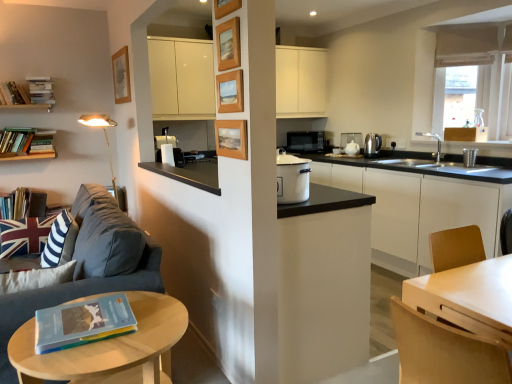
The image size is (512, 384). What do you see at coordinates (352, 148) in the screenshot? I see `white ceramic teapot at center, placed as the 4th appliance when sorted from right to left` at bounding box center [352, 148].

What is the approximate width of hardcover book at left, the 6th book positioned from the right?

hardcover book at left, the 6th book positioned from the right, is 7.42 inches wide.

Find the location of a particular element. white matte cabinet at center is located at coordinates (419, 204).

Image resolution: width=512 pixels, height=384 pixels. What do you see at coordinates (419, 204) in the screenshot? I see `white matte cabinet at center` at bounding box center [419, 204].

Where is `white ceramic teapot at center, positioned as the third appliance in back-to-front order`? Image resolution: width=512 pixels, height=384 pixels. white ceramic teapot at center, positioned as the third appliance in back-to-front order is located at coordinates (352, 148).

What's the angular difference between light wood/woodenobject at lower left and light brown wood chair at lower right's facing directions?

They differ by 89.2 degrees in their facing directions.

Which is nearer, (56, 356) or (452, 351)?

The point (452, 351) is closer.

Considering the positions of objects light wood/woodenobject at lower left and light brown wood chair at lower right in the image provided, who is more to the right, light wood/woodenobject at lower left or light brown wood chair at lower right?

From the viewer's perspective, light brown wood chair at lower right appears more on the right side.

Is light wood/woodenobject at lower left facing away from light brown wood chair at lower right?

Yes, light wood/woodenobject at lower left is positioned with its back facing light brown wood chair at lower right.

Is light wood/woodenobject at lower left to the right of black matte counter top at center from the viewer's perspective?

No.

Between point (34, 336) and point (210, 187), which one is positioned in front?

Positioned in front is point (34, 336).

From a real-world perspective, which is physically below, light wood/woodenobject at lower left or black matte counter top at center?

light wood/woodenobject at lower left, from a real-world perspective.

Is light wood/woodenobject at lower left oriented towards black matte counter top at center?

No, light wood/woodenobject at lower left is not oriented towards black matte counter top at center.

How many degrees apart are the facing directions of beige fabric curtain at upper right and hardcover books at upper left, the 5th book positioned from the front?

46.3 degrees separate the facing orientations of beige fabric curtain at upper right and hardcover books at upper left, the 5th book positioned from the front.

Between beige fabric curtain at upper right and hardcover books at upper left, which is counted as the third book, starting from the right, which one has larger size?

beige fabric curtain at upper right is bigger.

From the image's perspective, is beige fabric curtain at upper right located above hardcover books at upper left, the 4th book from the left?

Yes, from the image's perspective, beige fabric curtain at upper right is on top of hardcover books at upper left, the 4th book from the left.

Is beige fabric curtain at upper right facing away from hardcover books at upper left, which is counted as the third book, starting from the right?

No, hardcover books at upper left, which is counted as the third book, starting from the right, is not at the back of beige fabric curtain at upper right.

From their relative heights in the image, would you say white ceramic teapot at center, placed as the third appliance when sorted from front to back, is taller or shorter than satin silver kettle at right, which appears as the 4th appliance when viewed from the left?

white ceramic teapot at center, placed as the third appliance when sorted from front to back, is shorter than satin silver kettle at right, which appears as the 4th appliance when viewed from the left.

Based on their positions, is white ceramic teapot at center, placed as the third appliance when sorted from front to back, located to the left or right of satin silver kettle at right, marked as the 2th appliance in a right-to-left arrangement?

Based on their positions, white ceramic teapot at center, placed as the third appliance when sorted from front to back, is located to the left of satin silver kettle at right, marked as the 2th appliance in a right-to-left arrangement.

Would you say white ceramic teapot at center, placed as the 4th appliance when sorted from right to left, is outside satin silver kettle at right, which is the 4th appliance in back-to-front order?

That's correct, white ceramic teapot at center, placed as the 4th appliance when sorted from right to left, is outside of satin silver kettle at right, which is the 4th appliance in back-to-front order.

Based on the photo, from the image's perspective, which object appears higher, white ceramic teapot at center, positioned as the third appliance in back-to-front order, or satin silver kettle at right, placed as the second appliance when sorted from front to back?

white ceramic teapot at center, positioned as the third appliance in back-to-front order, from the image's perspective.

Consider the image. In terms of height, does hardcover book at left, the fourth book positioned from the front, look taller or shorter compared to beige fabric curtain at upper right?

Considering their sizes, hardcover book at left, the fourth book positioned from the front, has less height than beige fabric curtain at upper right.

Based on the photo, from the image's perspective, which is below, hardcover book at left, marked as the third book in a back-to-front arrangement, or beige fabric curtain at upper right?

hardcover book at left, marked as the third book in a back-to-front arrangement, from the image's perspective.

Measure the distance from hardcover book at left, the fourth book positioned from the front, to beige fabric curtain at upper right.

hardcover book at left, the fourth book positioned from the front, and beige fabric curtain at upper right are 12.55 feet apart.

Locate an element on the screen. This screenshot has width=512, height=384. window located above the hardcover book at left, which is counted as the fourth book, starting from the top (from the image's perspective) is located at coordinates (478, 59).

How far apart are dark gray fabric couch at left and hardcover books at upper left, the 4th book from the left?

dark gray fabric couch at left and hardcover books at upper left, the 4th book from the left, are 6.97 feet apart from each other.

Between point (24, 306) and point (38, 84), which one is positioned behind?

The point (38, 84) is more distant.

Is dark gray fabric couch at left smaller than hardcover books at upper left, the second book from the back?

No, dark gray fabric couch at left is not smaller than hardcover books at upper left, the second book from the back.

Which object is wider, dark gray fabric couch at left or hardcover books at upper left, the second book from the back?

dark gray fabric couch at left.

Can you confirm if metallic stainless steel cup at right, placed as the 1th appliance when sorted from right to left, is wider than hardcover book at lower left, the first book when ordered from front to back?

No, metallic stainless steel cup at right, placed as the 1th appliance when sorted from right to left, is not wider than hardcover book at lower left, the first book when ordered from front to back.

From a real-world perspective, relative to hardcover book at lower left, the 1th book from the bottom, is metallic stainless steel cup at right, which is counted as the 1th appliance, starting from the front, vertically above or below?

In terms of real-world spatial position, metallic stainless steel cup at right, which is counted as the 1th appliance, starting from the front, is above hardcover book at lower left, the 1th book from the bottom.

Based on the photo, is metallic stainless steel cup at right, placed as the 1th appliance when sorted from right to left, far away from hardcover book at lower left, the 1th book from the bottom?

Indeed, metallic stainless steel cup at right, placed as the 1th appliance when sorted from right to left, is not near hardcover book at lower left, the 1th book from the bottom.

Is point (470, 154) closer to camera compared to point (109, 312)?

That is False.

There is a light wood/woodenobject at lower left. What are the coordinates of `chair above it (from a real-world perspective)` in the screenshot? It's located at (445, 352).

In the image, there is a light wood/woodenobject at lower left. Where is `counter top above it (from the image's perspective)`? Image resolution: width=512 pixels, height=384 pixels. counter top above it (from the image's perspective) is located at coordinates (191, 172).

From the picture: Which object lies nearer to the anchor point white matte cabinet at center, hardcover book at left, the 4th book in the bottom-to-top sequence, or hardcover book at left, the fifth book viewed from the right?

hardcover book at left, the fifth book viewed from the right, is closer to white matte cabinet at center.

Looking at this image, when comparing their distances from white ceramic teapot at center, placed as the third appliance when sorted from front to back, does white ceramic teapot at center-right, which ranks as the 2th appliance in back-to-front order, or black matte microwave at center, acting as the first appliance starting from the back, seem closer?

white ceramic teapot at center-right, which ranks as the 2th appliance in back-to-front order.

From the image, which object appears to be nearer to hardcover book at lower left, which is counted as the sixth book, starting from the back, white matte cabinet at center or white ceramic teapot at center-right, which ranks as the 2th appliance in back-to-front order?

white matte cabinet at center lies closer to hardcover book at lower left, which is counted as the sixth book, starting from the back, than the other object.

In the scene shown: From the image, which object appears to be nearer to beige fabric curtain at upper right, black matte counter top at center or hardcover books at upper left, the second book from the back?

black matte counter top at center.

Estimate the real-world distances between objects in this image. Which object is further from hardcover book at left, which ranks as the second book in front-to-back order, hardcover book at left, which is the 1th book in back-to-front order, or white ceramic teapot at center-right, marked as the 4th appliance in a front-to-back arrangement?

Based on the image, white ceramic teapot at center-right, marked as the 4th appliance in a front-to-back arrangement, appears to be further to hardcover book at left, which ranks as the second book in front-to-back order.

Considering their positions, is satin silver kettle at right, placed as the second appliance when sorted from front to back, positioned further to light wood/woodenobject at lower left than white ceramic teapot at center, placed as the 4th appliance when sorted from right to left?

Based on the image, white ceramic teapot at center, placed as the 4th appliance when sorted from right to left, appears to be further to light wood/woodenobject at lower left.

Which object lies nearer to the anchor point black matte microwave at center, which is the first appliance from left to right, dark gray fabric couch at left or metallic stainless steel cup at right, which is counted as the 1th appliance, starting from the front?

Based on the image, metallic stainless steel cup at right, which is counted as the 1th appliance, starting from the front, appears to be nearer to black matte microwave at center, which is the first appliance from left to right.

When comparing their distances from black matte counter top at center, does light wood/woodenobject at lower left or white matte cabinet at center seem closer?

light wood/woodenobject at lower left.

Find the location of a particular element. table located between hardcover book at left, acting as the 3th book starting from the front, and light brown wood chair at lower right in the left-right direction is located at coordinates (109, 348).

This screenshot has width=512, height=384. In order to click on counter top between hardcover book at left, the 4th book in the bottom-to-top sequence, and white ceramic teapot at center-right, positioned as the third appliance in left-to-right order, from left to right in this screenshot , I will do `click(191, 172)`.

Find the location of a particular element. book positioned between hardcover book at lower left, arranged as the 1th book when viewed from the right, and hardcover book at left, which is the fifth book in top-to-bottom order, from near to far is located at coordinates (13, 94).

I want to click on cabinetry positioned between light brown wood chair at lower right and white ceramic teapot at center-right, positioned as the third appliance in left-to-right order, from near to far, so click(419, 204).